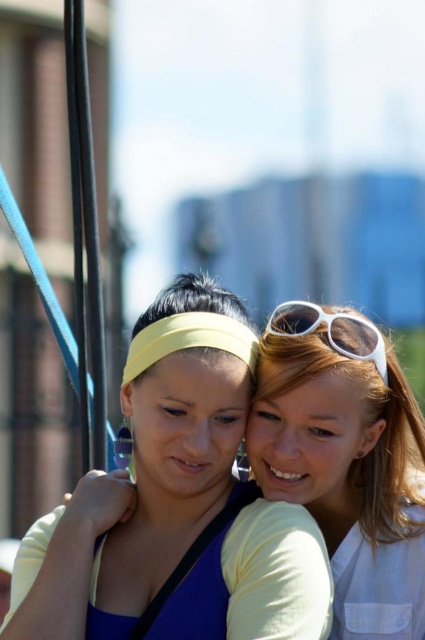
You are a photographer adjusting the focus of your camera. You notice two points in the image at coordinates point [342,372] and point [340,339]. Which point is closer to you?

Point [342,372] is further to the viewer than point [340,339], so point [340,339] is closer to you.

You are taking a photo of two people in an urban setting. You want to focus on the person closer to the camera. Which of the two points, point 1 at coordinates point (10,611) or point 2 at coordinates point (280,307), should you focus on to ensure the person closer to the camera is in focus?

Point 1 at coordinates point (10,611) is closer to the camera than point 2 at coordinates point (280,307), so you should focus on point 1 to ensure the person closer to the camera is in focus.

You are taking a photo of the scene described. The white matte sunglasses at upper right are positioned at coordinates approximately 0.736 on the x axis and 0.819 on the y axis. If you want to center your camera on the sunglasses, which direction should you move the camera? Please specify the direction as left, right, up, or down.

The white matte sunglasses at upper right are located at coordinates approximately 0.736 on the x axis and 0.819 on the y axis. To center them, move the camera to the left and down since the sunglasses are at the upper right of the image frame.